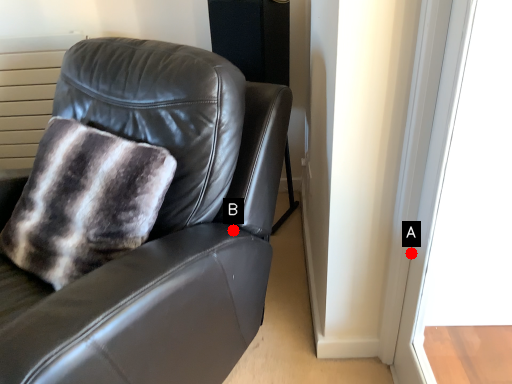
Question: Two points are circled on the image, labeled by A and B beside each circle. Among these points, which one is farthest from the camera?

Choices:
 (A) A is further
 (B) B is further

Answer: (A)